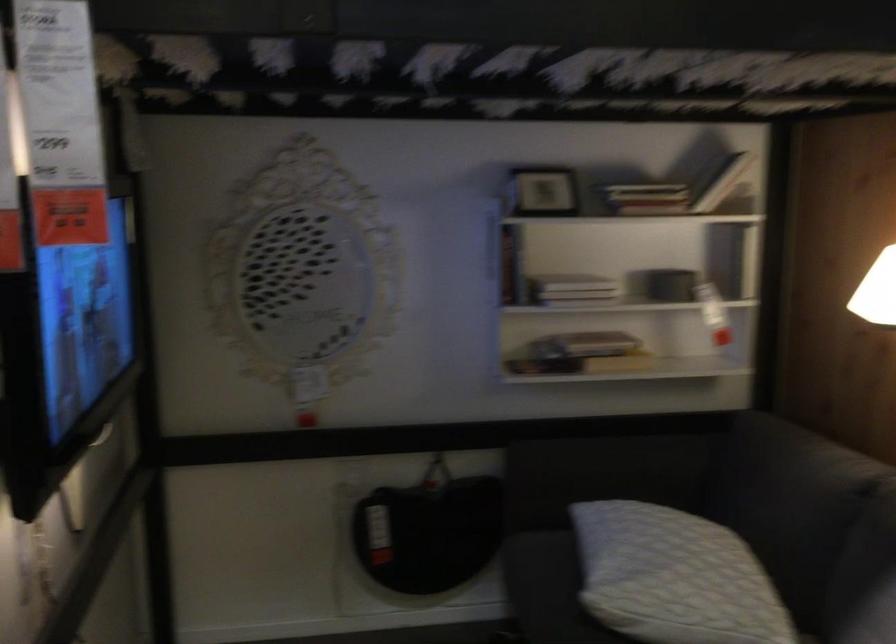
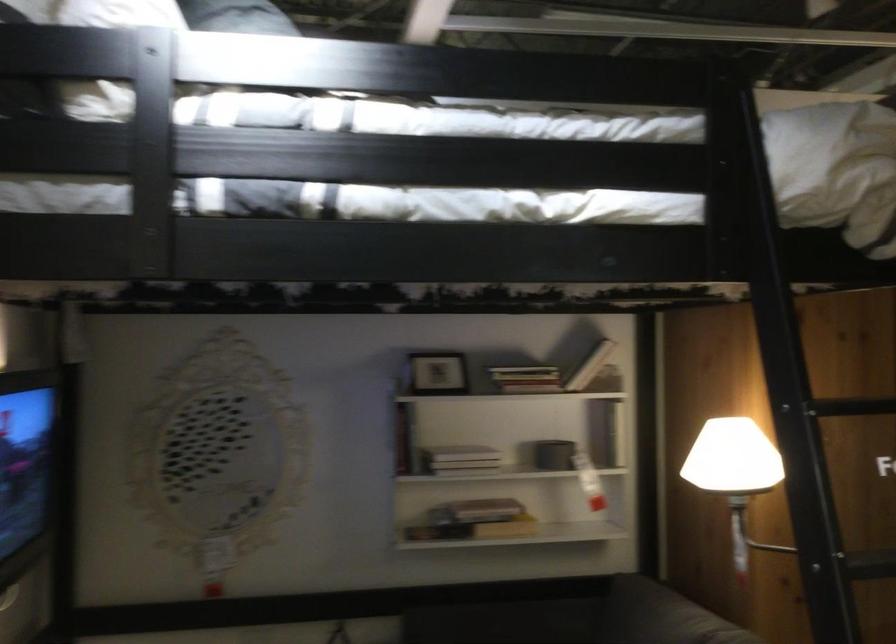
Locate, in the second image, the point that corresponds to (x=717, y=174) in the first image.

(590, 366)